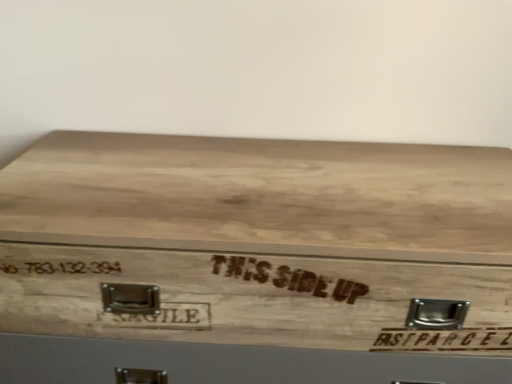
In order to click on natural wood box at center in this screenshot , I will do `click(254, 260)`.

Describe the element at coordinates (254, 260) in the screenshot. This screenshot has height=384, width=512. I see `natural wood box at center` at that location.

The height and width of the screenshot is (384, 512). Find the location of `natural wood box at center`. natural wood box at center is located at coordinates (254, 260).